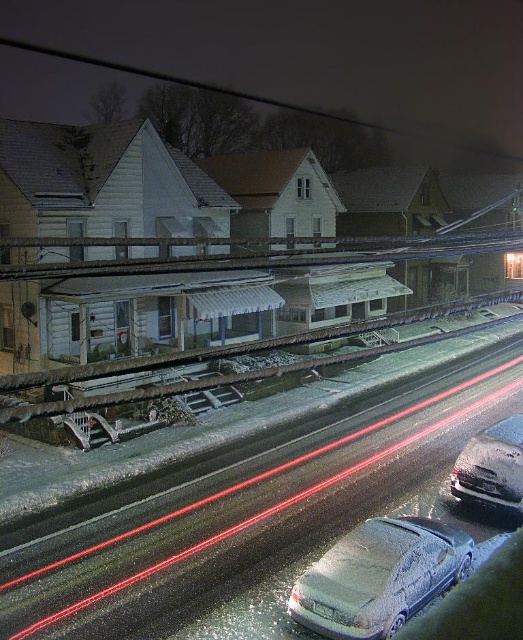
From the picture: Does snow-covered sedan at lower center have a greater height compared to sleek silver sedan at lower right?

No, snow-covered sedan at lower center is not taller than sleek silver sedan at lower right.

Who is shorter, snow-covered sedan at lower center or sleek silver sedan at lower right?

snow-covered sedan at lower center is shorter.

I want to click on snow-covered sedan at lower center, so click(x=380, y=577).